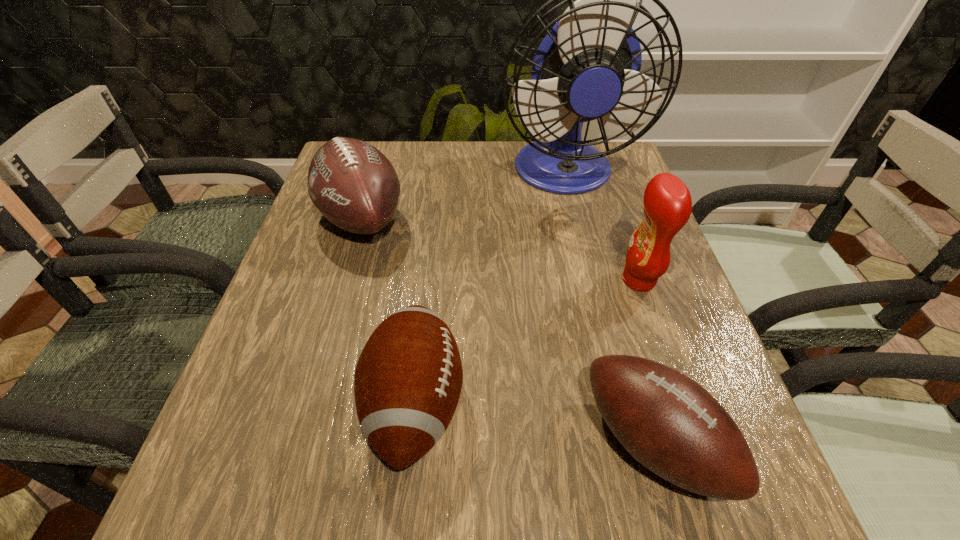
At what (x,y) coordinates should I click in order to perform the action: click on object that is at the near right corner. Please return your answer as a coordinate pair (x, y). Looking at the image, I should click on (670, 424).

The width and height of the screenshot is (960, 540). In order to click on free point at the far edge in this screenshot , I will do `click(516, 183)`.

Where is `vacant space at the near edge of the desktop`? vacant space at the near edge of the desktop is located at coordinates (399, 525).

Where is `vacant space at the left edge of the desktop`? The image size is (960, 540). vacant space at the left edge of the desktop is located at coordinates (331, 247).

The image size is (960, 540). Identify the location of free space at the right edge of the desktop. (636, 218).

You are a GUI agent. You are given a task and a screenshot of the screen. Output one action in this format:
    pyautogui.click(x=<x>, y=<y>)
    Task: Click on the vacant area that lies between the fourth shortest object and the tallest object
    The width and height of the screenshot is (960, 540).
    Given the screenshot: What is the action you would take?
    pyautogui.click(x=601, y=227)

Identify the location of free space between the farthest football (American) and the fan. This screenshot has height=540, width=960. (463, 196).

Where is `vacant point located between the third tallest object and the tallest object`? This screenshot has height=540, width=960. vacant point located between the third tallest object and the tallest object is located at coordinates (463, 196).

Identify the location of free spot between the rightmost football (American) and the farthest football (American). The image size is (960, 540). (508, 330).

Locate which object is the closest to the rightmost football (American). Please provide its 2D coordinates. Your answer should be formatted as a tuple, i.e. [(x, y)], where the tuple contains the x and y coordinates of a point satisfying the conditions above.

[(667, 201)]